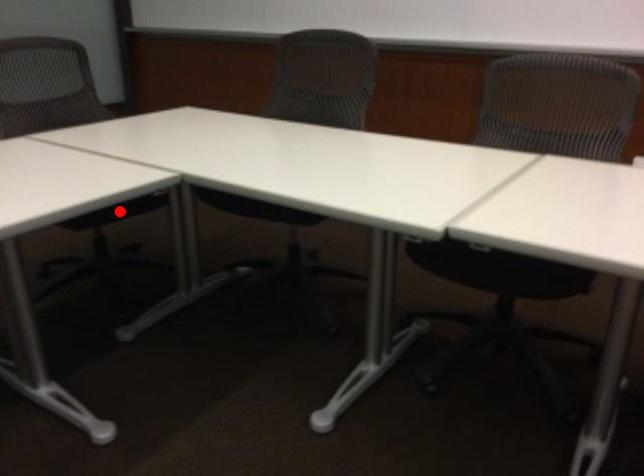
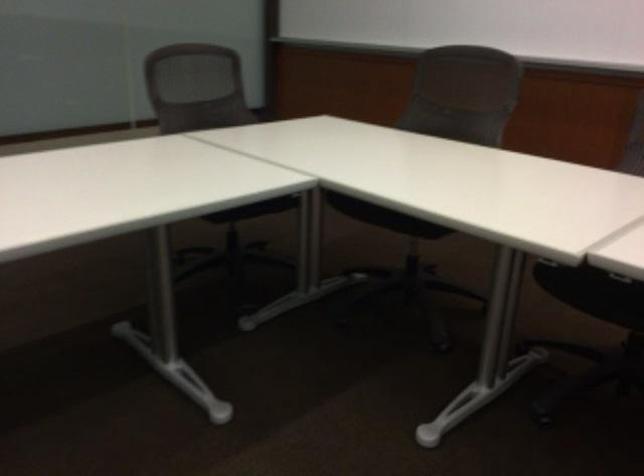
Find the pixel in the second image that matches the highlighted location in the first image.

(254, 209)